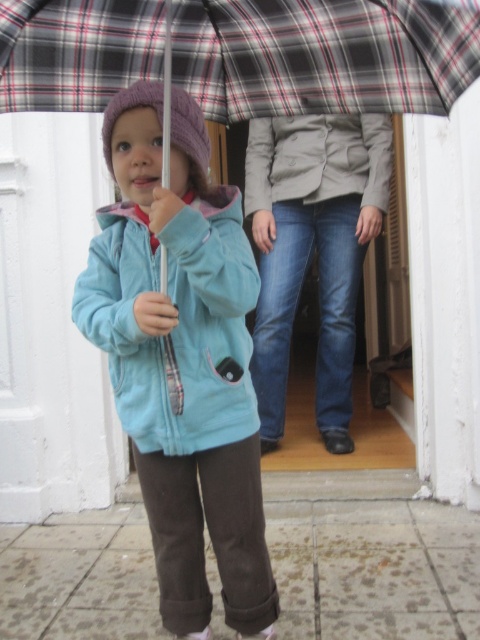
You are a delivery person who needs to place a package between the light blue fleece jacket at center and the light gray textured jacket at center. The package is 1.5 meters long. Can the package fit in the space between them?

The distance between the light blue fleece jacket at center and the light gray textured jacket at center is 1.63 meters. Since the package is 1.5 meters long, it can fit in the space between them as there is enough room.

In the scene shown: You are trying to decide which jacket to wear for a cold day. You see the light blue fleece jacket at center and the light gray textured jacket at center in the image. Which one would provide more warmth based on their thickness?

The light gray textured jacket at center is thicker than the light blue fleece jacket at center, so it would provide more warmth.

You are a fashion designer observing the child in the image. You need to determine the order of the clothing items from top to bottom. Which clothing item is located below the other between the matte blue jacket at center and the blue denim jeans at center?

The matte blue jacket at center is positioned under blue denim jeans at center, meaning the jacket is below the jeans.